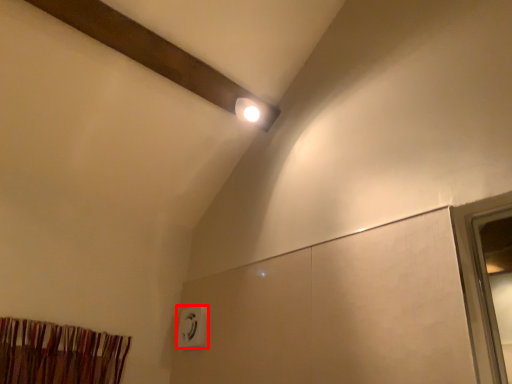
Question: Observing the image, what is the correct spatial positioning of electric outlet (annotated by the red box) in reference to curtain?

Choices:
 (A) right
 (B) left

Answer: (A)